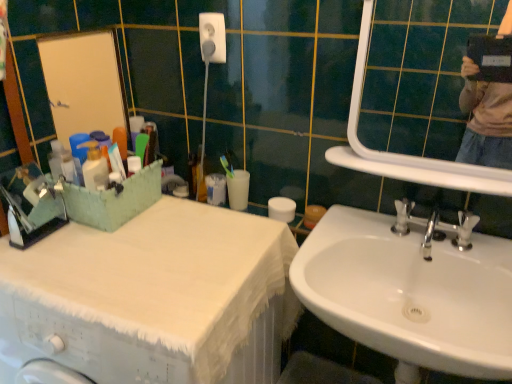
Question: Is white fabric covered at left further to the viewer compared to white glossy mirror at upper right?

Choices:
 (A) yes
 (B) no

Answer: (B)

Question: Considering the relative sizes of white fabric covered at left and white glossy mirror at upper right in the image provided, is white fabric covered at left thinner than white glossy mirror at upper right?

Choices:
 (A) no
 (B) yes

Answer: (A)

Question: From a real-world perspective, is white fabric covered at left below white glossy mirror at upper right?

Choices:
 (A) yes
 (B) no

Answer: (A)

Question: Is white fabric covered at left shorter than white glossy mirror at upper right?

Choices:
 (A) no
 (B) yes

Answer: (A)

Question: Can you confirm if white fabric covered at left is taller than white glossy mirror at upper right?

Choices:
 (A) yes
 (B) no

Answer: (A)

Question: Is white fabric covered at left in front of white glossy mirror at upper right?

Choices:
 (A) yes
 (B) no

Answer: (A)

Question: Can you confirm if white matte toilet paper at center is thinner than white glossy mirror at upper right?

Choices:
 (A) no
 (B) yes

Answer: (A)

Question: Does white matte toilet paper at center lie in front of white glossy mirror at upper right?

Choices:
 (A) no
 (B) yes

Answer: (A)

Question: Can you confirm if white matte toilet paper at center is shorter than white glossy mirror at upper right?

Choices:
 (A) yes
 (B) no

Answer: (A)

Question: Considering the relative sizes of white matte toilet paper at center and white glossy mirror at upper right in the image provided, is white matte toilet paper at center taller than white glossy mirror at upper right?

Choices:
 (A) no
 (B) yes

Answer: (A)

Question: Is white matte toilet paper at center aimed at white glossy mirror at upper right?

Choices:
 (A) yes
 (B) no

Answer: (B)

Question: From a real-world perspective, is white matte toilet paper at center on white glossy mirror at upper right?

Choices:
 (A) yes
 (B) no

Answer: (B)

Question: Can you confirm if white glossy mirror at upper right is taller than white glossy sink at lower right?

Choices:
 (A) no
 (B) yes

Answer: (B)